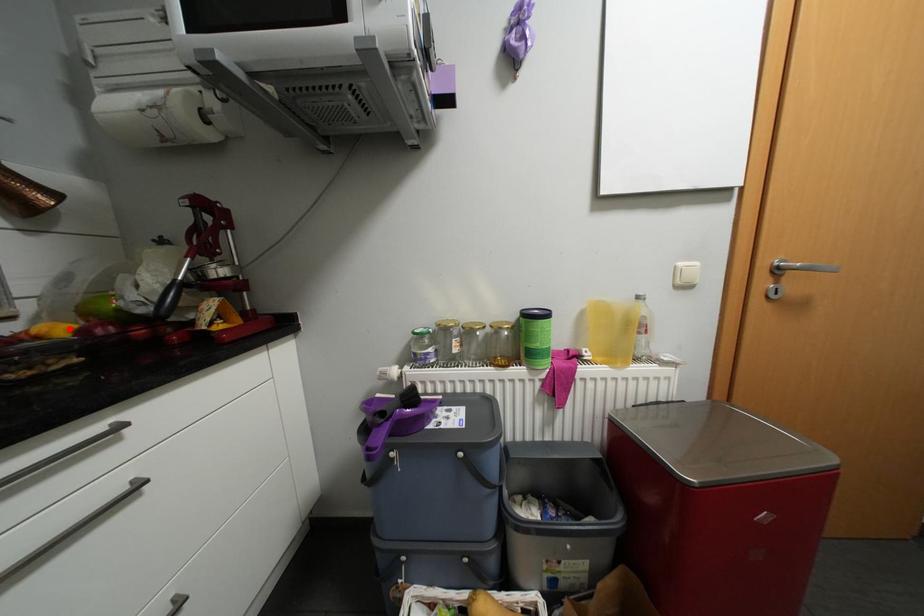
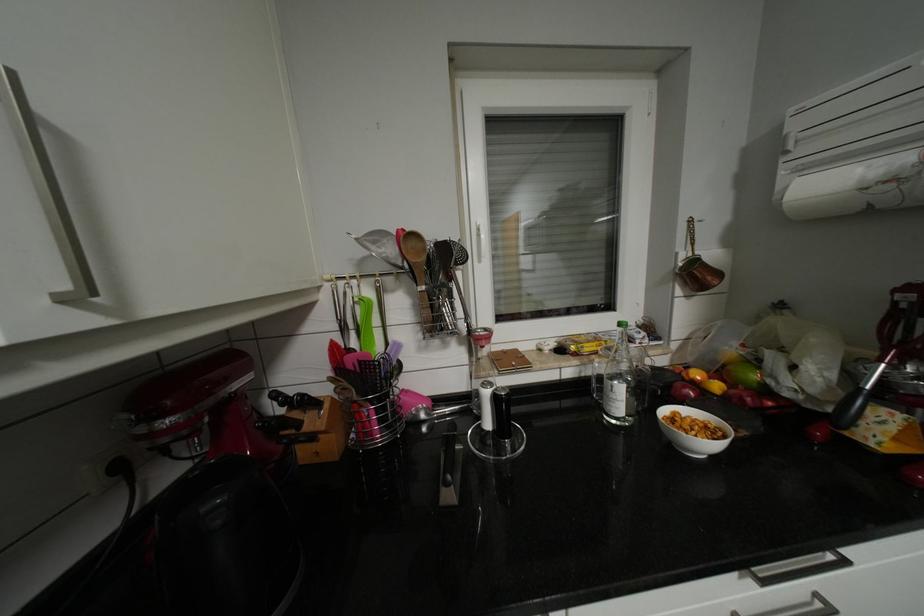
Find the pixel in the second image that matches the highlighted location in the first image.

(724, 386)